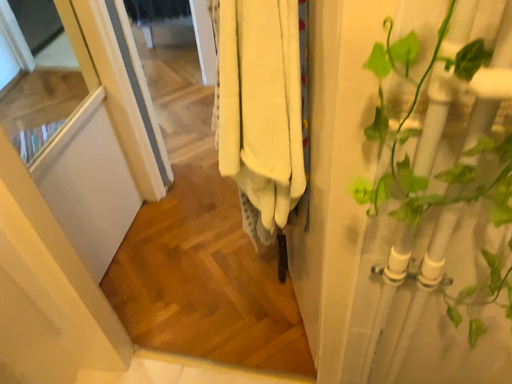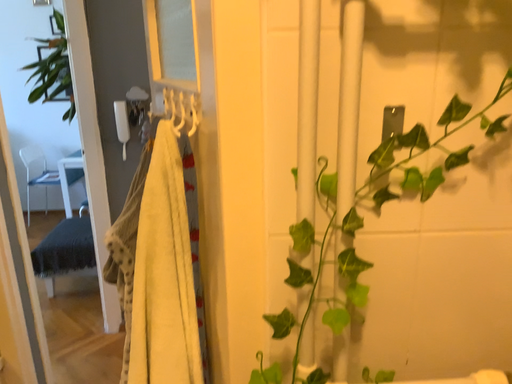
Question: How did the camera likely rotate when shooting the video?

Choices:
 (A) rotated upward
 (B) rotated downward

Answer: (A)